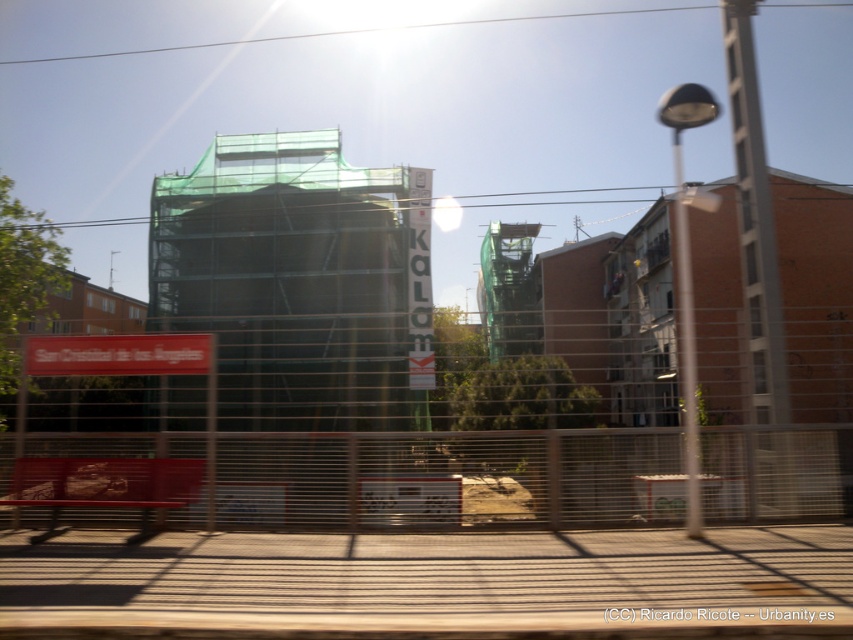
Question: Among these objects, which one is nearest to the camera?

Choices:
 (A) metallic wire mesh at lower center
 (B) brown wooden train track at lower center

Answer: (B)

Question: Is metallic wire mesh at center below brown wooden train track at lower center?

Choices:
 (A) yes
 (B) no

Answer: (A)

Question: Which of the following is the farthest from the observer?

Choices:
 (A) metallic wire mesh at center
 (B) metallic wire mesh at lower center
 (C) brown wooden train track at lower center

Answer: (B)

Question: Does metallic wire mesh at center appear on the right side of metallic wire mesh at lower center?

Choices:
 (A) yes
 (B) no

Answer: (A)

Question: Can you confirm if brown wooden train track at lower center is smaller than metallic wire mesh at lower center?

Choices:
 (A) yes
 (B) no

Answer: (B)

Question: Which object is the closest to the metallic wire mesh at center?

Choices:
 (A) brown wooden train track at lower center
 (B) metallic wire mesh at lower center

Answer: (A)